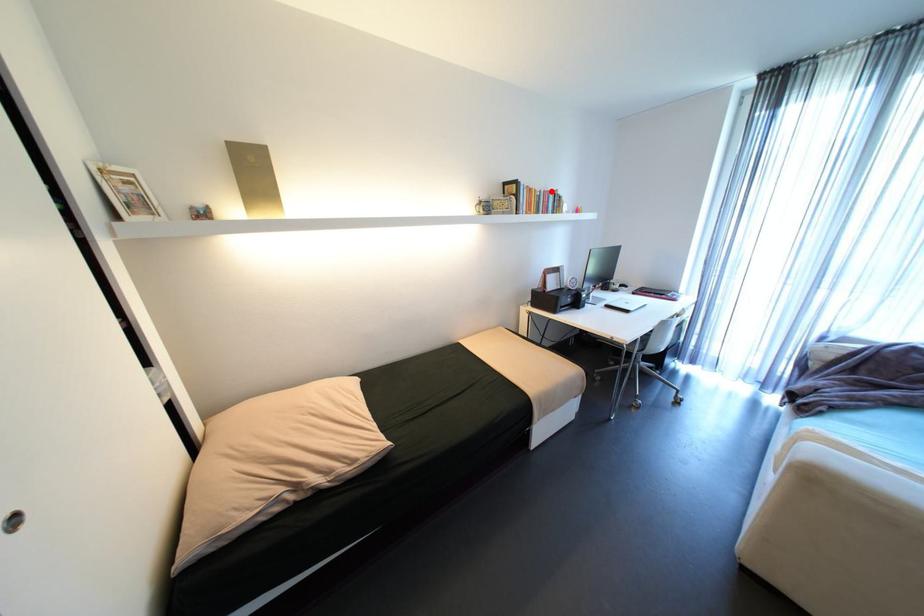
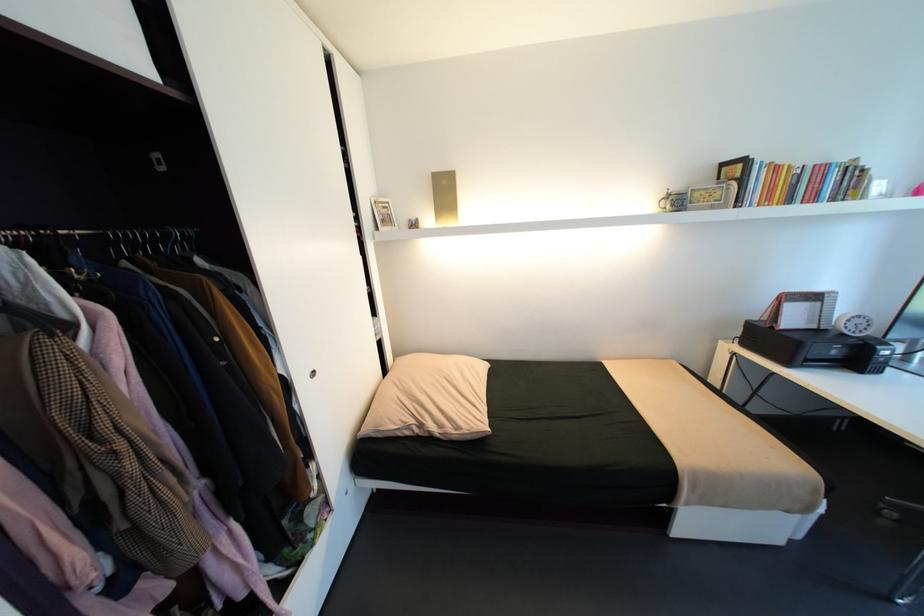
In the second image, find the point that corresponds to the highlighted location in the first image.

(821, 166)